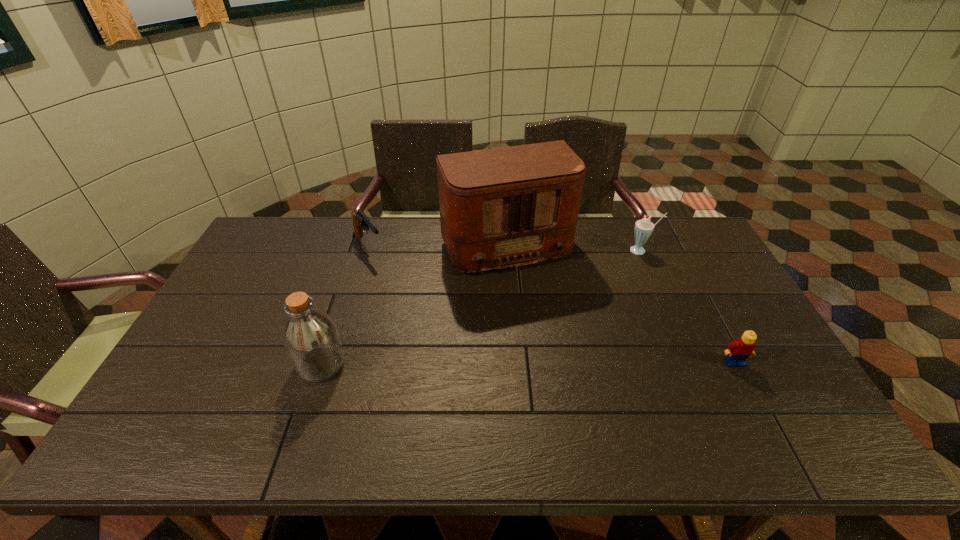
The height and width of the screenshot is (540, 960). Find the location of `vacant area that lies between the tallest object and the Lego`. vacant area that lies between the tallest object and the Lego is located at coordinates pyautogui.click(x=618, y=305).

Where is `vacant area that lies between the gun and the third object from right to left`? vacant area that lies between the gun and the third object from right to left is located at coordinates (436, 246).

This screenshot has width=960, height=540. Find the location of `vacant region between the bottle and the milkshake`. vacant region between the bottle and the milkshake is located at coordinates (481, 307).

Where is `vacant space in between the second tallest object and the rightmost object`? This screenshot has height=540, width=960. vacant space in between the second tallest object and the rightmost object is located at coordinates (528, 363).

Locate an element on the screen. free spot between the gun and the Lego is located at coordinates (551, 304).

In order to click on vacant region between the rightmost object and the tallest object in this screenshot , I will do `click(618, 305)`.

Point out which object is positioned as the nearest to the third object from left to right. Please provide its 2D coordinates. Your answer should be formatted as a tuple, i.e. [(x, y)], where the tuple contains the x and y coordinates of a point satisfying the conditions above.

[(360, 221)]

Locate an element on the screen. the closest object to the bottle is located at coordinates (505, 207).

At what (x,y) coordinates should I click in order to perform the action: click on vacant space that satisfies the following two spatial constraints: 1. on the back side of the milkshake; 2. on the right side of the bottle. Please return your answer as a coordinate pair (x, y). This screenshot has width=960, height=540. Looking at the image, I should click on (358, 251).

At what (x,y) coordinates should I click in order to perform the action: click on vacant space that satisfies the following two spatial constraints: 1. on the front side of the third tallest object; 2. on the right side of the gun. Please return your answer as a coordinate pair (x, y). This screenshot has width=960, height=540. Looking at the image, I should click on (367, 251).